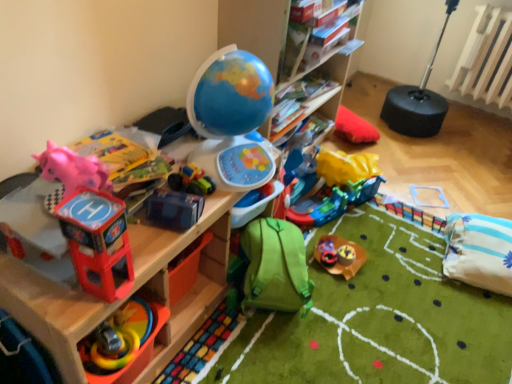
What do you see at coordinates (136, 353) in the screenshot?
I see `rubberized plastic toy at lower left, the second toy from the left` at bounding box center [136, 353].

The width and height of the screenshot is (512, 384). Describe the element at coordinates (274, 267) in the screenshot. I see `green fabric backpack at lower center, which is the sixth toy in left-to-right order` at that location.

You are a GUI agent. You are given a task and a screenshot of the screen. Output one action in this format:
    pyautogui.click(x=<x>, y=<y>)
    Task: Click on the white striped pillow at lower right
    
    Given the screenshot: What is the action you would take?
    pyautogui.click(x=479, y=251)

Measure the distance between rubberized plastic toy at center, the 2th toy viewed from the right, and camera.

rubberized plastic toy at center, the 2th toy viewed from the right, is 5.81 feet from camera.

You are a GUI agent. You are given a task and a screenshot of the screen. Output one action in this format:
    pyautogui.click(x=<x>, y=<y>)
    Task: Click on the blue plastic globe at upper center, the first shelf when ordered from top to bottom
    The width and height of the screenshot is (512, 384).
    Given the screenshot: What is the action you would take?
    pyautogui.click(x=255, y=29)

Identify the location of pink rubber duck at left, which appears as the 9th toy when viewed from the right. This screenshot has width=512, height=384. (34, 217).

Locate an element on the screen. Image resolution: width=512 pixels, height=384 pixels. rubberized plastic toy at lower left, arranged as the 8th toy when viewed from the right is located at coordinates (136, 353).

From a real-world perspective, is rubberized plastic toy at center, the seventh toy viewed from the left, positioned above or below shiny metallic toy car at center, the 9th toy in the left-to-right sequence?

In terms of real-world spatial position, rubberized plastic toy at center, the seventh toy viewed from the left, is below shiny metallic toy car at center, the 9th toy in the left-to-right sequence.

Is rubberized plastic toy at center, the third toy positioned from the right, facing towards shiny metallic toy car at center, which ranks as the 1th toy in right-to-left order?

No, rubberized plastic toy at center, the third toy positioned from the right, is not turned towards shiny metallic toy car at center, which ranks as the 1th toy in right-to-left order.

In the scene shown: Is rubberized plastic toy at center, the third toy positioned from the right, at the left side of shiny metallic toy car at center, which ranks as the 1th toy in right-to-left order?

Yes, rubberized plastic toy at center, the third toy positioned from the right, is to the left of shiny metallic toy car at center, which ranks as the 1th toy in right-to-left order.

From a real-world perspective, which object rests below the other?

rubberized plastic toy at lower left, the second toy from the left, is physically lower.

Between point (196, 195) and point (132, 374), which one is positioned behind?

Point (196, 195)

Are blue plastic toy at center, which ranks as the sixth toy in right-to-left order, and rubberized plastic toy at lower left, arranged as the 8th toy when viewed from the right, making contact?

They are not placed beside each other.

Is rubberized plastic toy at lower left, the second toy from the left, inside blue plastic toy at center, the 4th toy viewed from the left?

No, rubberized plastic toy at lower left, the second toy from the left, is not surrounded by blue plastic toy at center, the 4th toy viewed from the left.

Is white striped pillow at lower right taller than red plastic helicopter at left, the 7th toy viewed from the right?

No.

I want to click on the 7th toy to the left of the white striped pillow at lower right, counting from the anchor's position, so tap(91, 222).

From a real-world perspective, which is physically above, white striped pillow at lower right or red plastic helicopter at left, the 7th toy viewed from the right?

red plastic helicopter at left, the 7th toy viewed from the right.

In the scene shown: How different are the orientations of white striped pillow at lower right and red plastic helicopter at left, acting as the third toy starting from the left, in degrees?

166 degrees separate the facing orientations of white striped pillow at lower right and red plastic helicopter at left, acting as the third toy starting from the left.

In the scene shown: Could you tell me if rubberized plastic toy at lower left, arranged as the 8th toy when viewed from the right, is turned towards wooden shelf at upper center, which appears as the 2th shelf when viewed from the top?

Yes, rubberized plastic toy at lower left, arranged as the 8th toy when viewed from the right, faces towards wooden shelf at upper center, which appears as the 2th shelf when viewed from the top.

Between rubberized plastic toy at lower left, the second toy from the left, and wooden shelf at upper center, arranged as the first shelf when ordered from the bottom, which one has smaller size?

rubberized plastic toy at lower left, the second toy from the left, is smaller.

From a real-world perspective, is rubberized plastic toy at lower left, the second toy from the left, located higher than wooden shelf at upper center, arranged as the first shelf when ordered from the bottom?

Yes, from a real-world perspective, rubberized plastic toy at lower left, the second toy from the left, is over wooden shelf at upper center, arranged as the first shelf when ordered from the bottom

The height and width of the screenshot is (384, 512). I want to click on the 1st toy directly above the wooden shelf at upper center, arranged as the first shelf when ordered from the bottom (from a real-world perspective), so click(x=136, y=353).

Would you say blue plastic toy at center, which ranks as the sixth toy in right-to-left order, is a long distance from wooden shelf at upper center, which appears as the 2th shelf when viewed from the top?

They are positioned close to each other.

Which of these two, blue plastic toy at center, the 4th toy viewed from the left, or wooden shelf at upper center, arranged as the first shelf when ordered from the bottom, is bigger?

wooden shelf at upper center, arranged as the first shelf when ordered from the bottom, is bigger.

Is blue plastic toy at center, which ranks as the sixth toy in right-to-left order, taller than wooden shelf at upper center, arranged as the first shelf when ordered from the bottom?

No.

From the picture: Is blue plastic toy at center, the 4th toy viewed from the left, aimed at wooden shelf at upper center, arranged as the first shelf when ordered from the bottom?

No, blue plastic toy at center, the 4th toy viewed from the left, is not oriented towards wooden shelf at upper center, arranged as the first shelf when ordered from the bottom.

Considering the positions of objects blue matte globe at center, which appears as the fifth toy when viewed from the right, and blue plastic globe at upper center, which is the 2th shelf from bottom to top, in the image provided, who is behind, blue matte globe at center, which appears as the fifth toy when viewed from the right, or blue plastic globe at upper center, which is the 2th shelf from bottom to top,?

Positioned behind is blue plastic globe at upper center, which is the 2th shelf from bottom to top.

From the image's perspective, is blue matte globe at center, marked as the fifth toy in a left-to-right arrangement, above blue plastic globe at upper center, which is the 2th shelf from bottom to top?

No, from the image's perspective, blue matte globe at center, marked as the fifth toy in a left-to-right arrangement, is not over blue plastic globe at upper center, which is the 2th shelf from bottom to top.

Which is behind, point (224, 174) or point (329, 97)?

The point (329, 97) is farther.

Locate an element on the screen. Image resolution: width=512 pixels, height=384 pixels. shelf behind the blue matte globe at center, marked as the fifth toy in a left-to-right arrangement is located at coordinates (255, 29).

Could you measure the distance between rubberized plastic toy at center, which is the eighth toy from left to right, and rubberized plastic toy at center, the seventh toy viewed from the left?

rubberized plastic toy at center, which is the eighth toy from left to right, is 1.47 inches from rubberized plastic toy at center, the seventh toy viewed from the left.

Do you think rubberized plastic toy at center, which is the eighth toy from left to right, is within rubberized plastic toy at center, the third toy positioned from the right, or outside of it?

rubberized plastic toy at center, which is the eighth toy from left to right, cannot be found inside rubberized plastic toy at center, the third toy positioned from the right.

Considering the relative positions of rubberized plastic toy at center, the 2th toy viewed from the right, and rubberized plastic toy at center, the third toy positioned from the right, in the image provided, is rubberized plastic toy at center, the 2th toy viewed from the right, behind rubberized plastic toy at center, the third toy positioned from the right,?

No.

Does rubberized plastic toy at center, the 2th toy viewed from the right, have a larger size compared to rubberized plastic toy at center, the seventh toy viewed from the left?

Yes.

The width and height of the screenshot is (512, 384). In order to click on the 2nd toy above the rubberized plastic toy at center, the seventh toy viewed from the left (from a real-world perspective) in this screenshot , I will do `click(346, 255)`.

From the rubberized plastic toy at lower left, arranged as the 8th toy when viewed from the right, count 1st toys backward and point to it. Please provide its 2D coordinates.

[(174, 209)]

Considering their positions, is rubberized plastic toy at center, the 2th toy viewed from the right, positioned closer to white painted wood radiator at upper right than blue matte globe at center, which appears as the fifth toy when viewed from the right?

rubberized plastic toy at center, the 2th toy viewed from the right, is positioned closer to the anchor white painted wood radiator at upper right.

From the image, which object appears to be nearer to white painted wood radiator at upper right, pink rubber duck at left, which appears as the 9th toy when viewed from the right, or blue matte globe at center, which appears as the fifth toy when viewed from the right?

blue matte globe at center, which appears as the fifth toy when viewed from the right, lies closer to white painted wood radiator at upper right than the other object.

Based on their spatial positions, is white painted wood radiator at upper right or blue plastic globe at upper center, which is the 2th shelf from bottom to top, further from shiny metallic toy car at center, the 9th toy in the left-to-right sequence?

Among the two, white painted wood radiator at upper right is located further to shiny metallic toy car at center, the 9th toy in the left-to-right sequence.

Which object lies further to the anchor point pink rubber duck at left, which is the 1th toy from left to right, blue plastic toy at center, the 4th toy viewed from the left, or blue matte globe at center, marked as the fifth toy in a left-to-right arrangement?

blue matte globe at center, marked as the fifth toy in a left-to-right arrangement, is positioned further to the anchor pink rubber duck at left, which is the 1th toy from left to right.

Looking at the image, which one is located further to rubberized plastic toy at lower left, arranged as the 8th toy when viewed from the right, blue plastic globe at upper center, the first shelf when ordered from top to bottom, or pink rubber duck at left, which is the 1th toy from left to right?

The object further to rubberized plastic toy at lower left, arranged as the 8th toy when viewed from the right, is blue plastic globe at upper center, the first shelf when ordered from top to bottom.

Based on their spatial positions, is green fabric backpack at lower center, which is the sixth toy in left-to-right order, or white striped pillow at lower right further from wooden shelf at upper center, arranged as the first shelf when ordered from the bottom?

Based on the image, white striped pillow at lower right appears to be further to wooden shelf at upper center, arranged as the first shelf when ordered from the bottom.

Estimate the real-world distances between objects in this image. Which object is further from blue matte globe at center, marked as the fifth toy in a left-to-right arrangement, rubberized plastic toy at center, which is the eighth toy from left to right, or pink rubber duck at left, which appears as the 9th toy when viewed from the right?

The object further to blue matte globe at center, marked as the fifth toy in a left-to-right arrangement, is rubberized plastic toy at center, which is the eighth toy from left to right.

From the image, which object appears to be nearer to pink rubber duck at left, which is the 1th toy from left to right, rubberized plastic toy at center, the 2th toy viewed from the right, or blue matte globe at center, which appears as the fifth toy when viewed from the right?

blue matte globe at center, which appears as the fifth toy when viewed from the right, lies closer to pink rubber duck at left, which is the 1th toy from left to right, than the other object.

Locate an element on the screen. pillow between blue plastic globe at upper center, the first shelf when ordered from top to bottom, and shiny metallic toy car at center, which ranks as the 1th toy in right-to-left order, from top to bottom is located at coordinates (479, 251).

Locate an element on the screen. shelf between pink rubber duck at left, which appears as the 9th toy when viewed from the right, and blue plastic globe at upper center, the first shelf when ordered from top to bottom, from left to right is located at coordinates (193, 284).

Locate an element on the screen. The image size is (512, 384). pillow between rubberized plastic toy at lower left, the second toy from the left, and white painted wood radiator at upper right from left to right is located at coordinates (479, 251).

Locate an element on the screen. The image size is (512, 384). shelf between pink rubber duck at left, which is the 1th toy from left to right, and blue plastic toy at center, the 4th toy viewed from the left, from left to right is located at coordinates (193, 284).